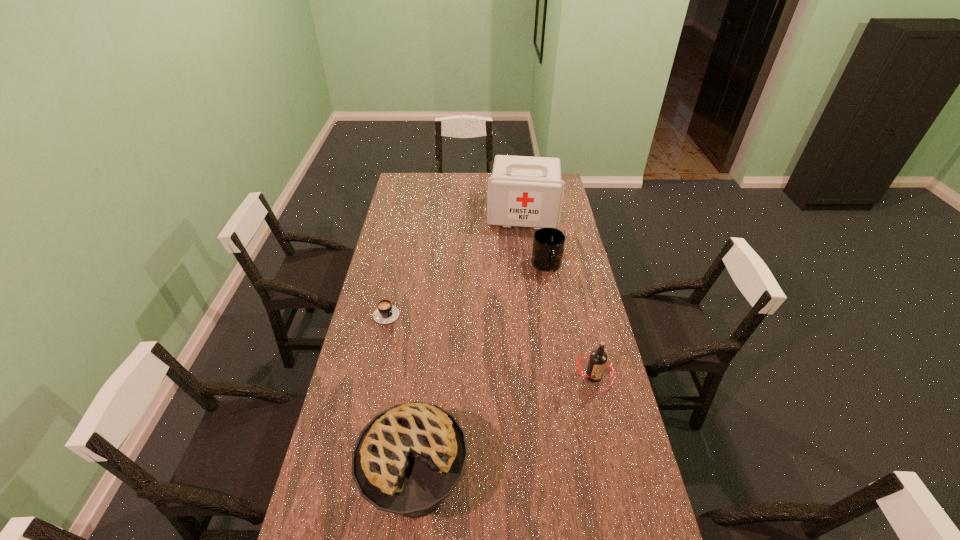
Locate an element on the screen. This screenshot has width=960, height=540. vacant space located 0.090m with the handle on the side of the mug is located at coordinates (545, 294).

In order to click on vacant area situated 0.340m with the handle on the side of the mug in this screenshot , I will do pyautogui.click(x=540, y=339).

Identify the location of blank area located 0.300m on the front-facing side of the tallest object. (517, 272).

The image size is (960, 540). Identify the location of blank space located 0.080m on the front-facing side of the tallest object. (520, 241).

This screenshot has width=960, height=540. I want to click on free space located on the front-facing side of the tallest object, so click(516, 286).

In order to click on free location located 0.400m with the handle on the side of the cappuccino in this screenshot , I will do `click(456, 389)`.

Locate an element on the screen. The width and height of the screenshot is (960, 540). vacant space located 0.090m with the handle on the side of the cappuccino is located at coordinates (406, 335).

Where is `vacant space positioned with the handle on the side of the cappuccino`? vacant space positioned with the handle on the side of the cappuccino is located at coordinates (408, 337).

Where is `object at the left edge`? Image resolution: width=960 pixels, height=540 pixels. object at the left edge is located at coordinates tap(385, 313).

At what (x,y) coordinates should I click in order to perform the action: click on root beer that is at the right edge. Please return your answer as a coordinate pair (x, y). This screenshot has width=960, height=540. Looking at the image, I should click on (598, 360).